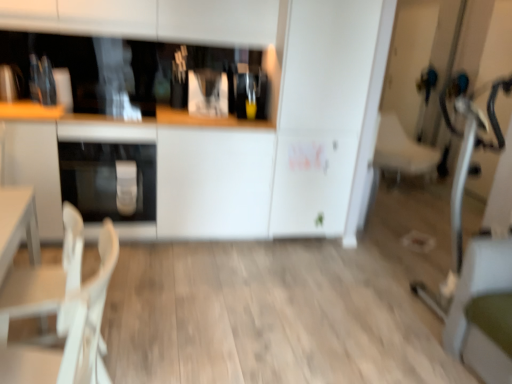
Find the location of a particular element. satin silver oven at lower left is located at coordinates (106, 179).

Where is `white fabric armchair at right, which is counted as the 2th armchair, starting from the front`? This screenshot has height=384, width=512. white fabric armchair at right, which is counted as the 2th armchair, starting from the front is located at coordinates (402, 150).

Is white plastic chair at lower left, placed as the second armchair when sorted from back to front, shorter than satin silver oven at lower left?

In fact, white plastic chair at lower left, placed as the second armchair when sorted from back to front, may be taller than satin silver oven at lower left.

In the scene shown: From a real-world perspective, is white plastic chair at lower left, which is the second armchair in top-to-bottom order, physically above satin silver oven at lower left?

No, from a real-world perspective, white plastic chair at lower left, which is the second armchair in top-to-bottom order, is not on top of satin silver oven at lower left.

In terms of size, does white plastic chair at lower left, which is the second armchair in top-to-bottom order, appear bigger or smaller than satin silver oven at lower left?

Clearly, white plastic chair at lower left, which is the second armchair in top-to-bottom order, is smaller in size than satin silver oven at lower left.

Find the location of a particular element. This screenshot has width=512, height=384. counter top that is in front of the satin silver oven at lower left is located at coordinates (157, 173).

Is satin silver oven at lower left in front of or behind wooden counter top at center in the image?

satin silver oven at lower left is positioned farther from the viewer than wooden counter top at center.

Considering the sizes of satin silver oven at lower left and wooden counter top at center in the image, is satin silver oven at lower left wider or thinner than wooden counter top at center?

Considering their sizes, satin silver oven at lower left looks slimmer than wooden counter top at center.

Does point (83, 179) appear closer or farther from the camera than point (206, 186)?

Clearly, point (83, 179) is more distant from the camera than point (206, 186).

Considering the sizes of white plastic chair at lower left, placed as the second armchair when sorted from back to front, and wooden counter top at center in the image, is white plastic chair at lower left, placed as the second armchair when sorted from back to front, bigger or smaller than wooden counter top at center?

white plastic chair at lower left, placed as the second armchair when sorted from back to front, is smaller than wooden counter top at center.

Locate an element on the screen. The height and width of the screenshot is (384, 512). armchair in front of the wooden counter top at center is located at coordinates (44, 279).

Is white plastic chair at lower left, placed as the 1th armchair when sorted from left to right, further to the viewer compared to wooden counter top at center?

No, the depth of white plastic chair at lower left, placed as the 1th armchair when sorted from left to right, is less than that of wooden counter top at center.

Can you confirm if white plastic chair at lower left, placed as the second armchair when sorted from back to front, is wider than wooden counter top at center?

Incorrect, the width of white plastic chair at lower left, placed as the second armchair when sorted from back to front, does not surpass that of wooden counter top at center.

Would you say wooden counter top at center is a long distance from white fabric armchair at right, which is the 2th armchair in bottom-to-top order?

Indeed, wooden counter top at center is not near white fabric armchair at right, which is the 2th armchair in bottom-to-top order.

Could you tell me if wooden counter top at center is facing white fabric armchair at right, the first armchair from the top?

No, wooden counter top at center is not turned towards white fabric armchair at right, the first armchair from the top.

Is the depth of wooden counter top at center greater than that of white plastic chair at lower left, placed as the second armchair when sorted from back to front?

Yes, the depth of wooden counter top at center is greater than that of white plastic chair at lower left, placed as the second armchair when sorted from back to front.

Considering the positions of objects wooden counter top at center and white plastic chair at lower left, which is the second armchair in top-to-bottom order, in the image provided, who is more to the left, wooden counter top at center or white plastic chair at lower left, which is the second armchair in top-to-bottom order,?

wooden counter top at center.

From a real-world perspective, who is located lower, wooden counter top at center or white plastic chair at lower left, which is counted as the 2th armchair, starting from the right?

white plastic chair at lower left, which is counted as the 2th armchair, starting from the right, from a real-world perspective.

Where is `counter top located above the white plastic chair at lower left, marked as the first armchair in a bottom-to-top arrangement (from the image's perspective)`? The width and height of the screenshot is (512, 384). counter top located above the white plastic chair at lower left, marked as the first armchair in a bottom-to-top arrangement (from the image's perspective) is located at coordinates (157, 173).

Is white plastic chair at lower left, which is the second armchair in top-to-bottom order, with white fabric armchair at right, the 1th armchair viewed from the back?

white plastic chair at lower left, which is the second armchair in top-to-bottom order, and white fabric armchair at right, the 1th armchair viewed from the back, are clearly separated.

Which of these two, white plastic chair at lower left, placed as the 1th armchair when sorted from left to right, or white fabric armchair at right, which is counted as the 2th armchair, starting from the front, stands shorter?

With less height is white fabric armchair at right, which is counted as the 2th armchair, starting from the front.

Considering the relative sizes of white plastic chair at lower left, placed as the second armchair when sorted from back to front, and white fabric armchair at right, the 1th armchair positioned from the right, in the image provided, is white plastic chair at lower left, placed as the second armchair when sorted from back to front, wider than white fabric armchair at right, the 1th armchair positioned from the right,?

In fact, white plastic chair at lower left, placed as the second armchair when sorted from back to front, might be narrower than white fabric armchair at right, the 1th armchair positioned from the right.

Is white plastic chair at lower left, which is the first armchair from front to back, outside of white fabric armchair at right, the 2th armchair positioned from the left?

Indeed, white plastic chair at lower left, which is the first armchair from front to back, is completely outside white fabric armchair at right, the 2th armchair positioned from the left.

Is white fabric armchair at right, the 1th armchair viewed from the back, thinner than wooden counter top at center?

No, white fabric armchair at right, the 1th armchair viewed from the back, is not thinner than wooden counter top at center.

From the picture: Could you tell me if white fabric armchair at right, which is counted as the 2th armchair, starting from the front, is facing wooden counter top at center?

No, white fabric armchair at right, which is counted as the 2th armchair, starting from the front, is not oriented towards wooden counter top at center.

Looking at this image, is white fabric armchair at right, the 1th armchair viewed from the back, situated inside wooden counter top at center or outside?

white fabric armchair at right, the 1th armchair viewed from the back, is outside wooden counter top at center.

From the image's perspective, is white fabric armchair at right, the first armchair from the top, located above or below wooden counter top at center?

Based on their image positions, white fabric armchair at right, the first armchair from the top, is located above wooden counter top at center.

This screenshot has height=384, width=512. Identify the location of the 1st armchair counting from the right of the satin silver oven at lower left. (44, 279).

This screenshot has height=384, width=512. What are the coordinates of `oven above the wooden counter top at center (from a real-world perspective)` in the screenshot? It's located at (106, 179).

In the scene shown: Estimate the real-world distances between objects in this image. Which object is further from white fabric armchair at right, which is counted as the 2th armchair, starting from the front, wooden counter top at center or white plastic chair at lower left, which is counted as the 2th armchair, starting from the right?

Among the two, white plastic chair at lower left, which is counted as the 2th armchair, starting from the right, is located further to white fabric armchair at right, which is counted as the 2th armchair, starting from the front.

In the scene shown: Based on their spatial positions, is satin silver oven at lower left or white plastic chair at lower left, placed as the second armchair when sorted from back to front, closer to wooden counter top at center?

The object closer to wooden counter top at center is satin silver oven at lower left.

When comparing their distances from white plastic chair at lower left, which is the second armchair in top-to-bottom order, does white fabric armchair at right, the 1th armchair positioned from the right, or wooden counter top at center seem further?

Based on the image, white fabric armchair at right, the 1th armchair positioned from the right, appears to be further to white plastic chair at lower left, which is the second armchair in top-to-bottom order.

When comparing their distances from white fabric armchair at right, which is the 2th armchair in bottom-to-top order, does white plastic chair at lower left, marked as the first armchair in a bottom-to-top arrangement, or satin silver oven at lower left seem further?

Based on the image, white plastic chair at lower left, marked as the first armchair in a bottom-to-top arrangement, appears to be further to white fabric armchair at right, which is the 2th armchair in bottom-to-top order.

Based on their spatial positions, is white plastic chair at lower left, placed as the second armchair when sorted from back to front, or satin silver oven at lower left closer to wooden counter top at center?

satin silver oven at lower left.

Which object lies nearer to the anchor point white plastic chair at lower left, which is the second armchair in top-to-bottom order, white fabric armchair at right, the 2th armchair positioned from the left, or satin silver oven at lower left?

satin silver oven at lower left is positioned closer to the anchor white plastic chair at lower left, which is the second armchair in top-to-bottom order.

Looking at the image, which one is located further to white fabric armchair at right, the 1th armchair positioned from the right, wooden counter top at center or satin silver oven at lower left?

satin silver oven at lower left.

Based on their spatial positions, is satin silver oven at lower left or white fabric armchair at right, the 1th armchair viewed from the back, further from white plastic chair at lower left, placed as the 1th armchair when sorted from left to right?

white fabric armchair at right, the 1th armchair viewed from the back, lies further to white plastic chair at lower left, placed as the 1th armchair when sorted from left to right, than the other object.

The width and height of the screenshot is (512, 384). I want to click on counter top positioned between white plastic chair at lower left, which is the first armchair from front to back, and white fabric armchair at right, which is the 2th armchair in bottom-to-top order, from near to far, so click(157, 173).

Image resolution: width=512 pixels, height=384 pixels. Identify the location of counter top between white plastic chair at lower left, which is the second armchair in top-to-bottom order, and satin silver oven at lower left from front to back. (157, 173).

Identify the location of oven positioned between white plastic chair at lower left, which is the second armchair in top-to-bottom order, and white fabric armchair at right, the 1th armchair viewed from the back, from near to far. (106, 179).

Locate an element on the screen. This screenshot has width=512, height=384. counter top located between satin silver oven at lower left and white fabric armchair at right, the first armchair from the top, in the left-right direction is located at coordinates (157, 173).